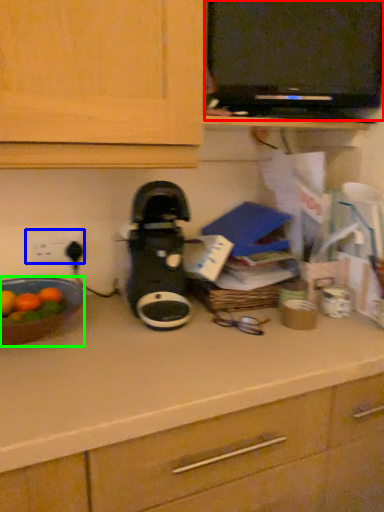
Question: Considering the real-world distances, which object is farthest from appliance (highlighted by a red box)? electric outlet (highlighted by a blue box) or kitchen appliance (highlighted by a green box)?

Choices:
 (A) electric outlet
 (B) kitchen appliance

Answer: (B)